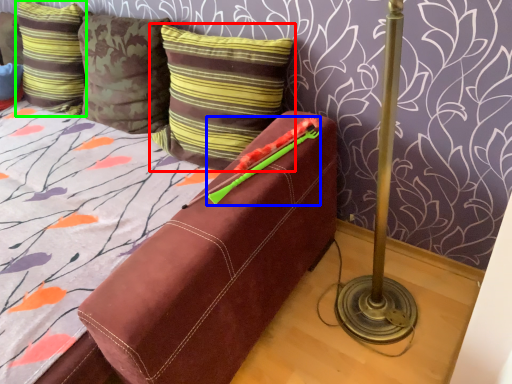
Question: Based on their relative distances, which object is farther from pillow (highlighted by a red box)? Choose from crayon (highlighted by a blue box) and pillow (highlighted by a green box).

Choices:
 (A) crayon
 (B) pillow

Answer: (B)